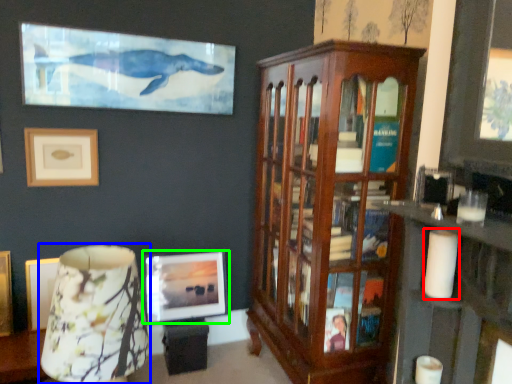
Question: Which object is the farthest from candle (highlighted by a red box)? Choose among these: table lamp (highlighted by a blue box) or picture frame (highlighted by a green box).

Choices:
 (A) table lamp
 (B) picture frame

Answer: (B)